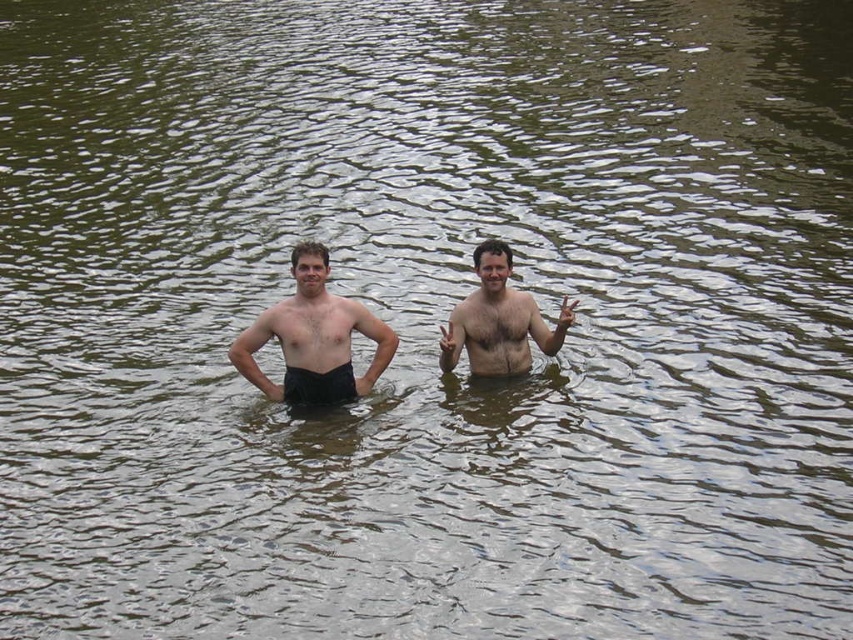
Is smooth skin couple at center positioned at the back of matte black shorts at center?

Yes, it is.

What do you see at coordinates (312, 339) in the screenshot? The width and height of the screenshot is (853, 640). I see `smooth skin couple at center` at bounding box center [312, 339].

Locate an element on the screen. This screenshot has width=853, height=640. smooth skin couple at center is located at coordinates (312, 339).

This screenshot has height=640, width=853. I want to click on smooth skin couple at center, so click(x=312, y=339).

Does smooth skin couple at center have a larger size compared to black cotton shorts at center?

No.

Between point (381, 337) and point (311, 378), which one is positioned behind?

Positioned behind is point (381, 337).

Locate an element on the screen. The width and height of the screenshot is (853, 640). smooth skin couple at center is located at coordinates (312, 339).

Can you confirm if light brown skin at center is thinner than black cotton shorts at center?

No, light brown skin at center is not thinner than black cotton shorts at center.

Is light brown skin at center smaller than black cotton shorts at center?

No, light brown skin at center is not smaller than black cotton shorts at center.

Is point (509, 328) positioned before point (312, 372)?

No.

This screenshot has width=853, height=640. Identify the location of light brown skin at center. (498, 321).